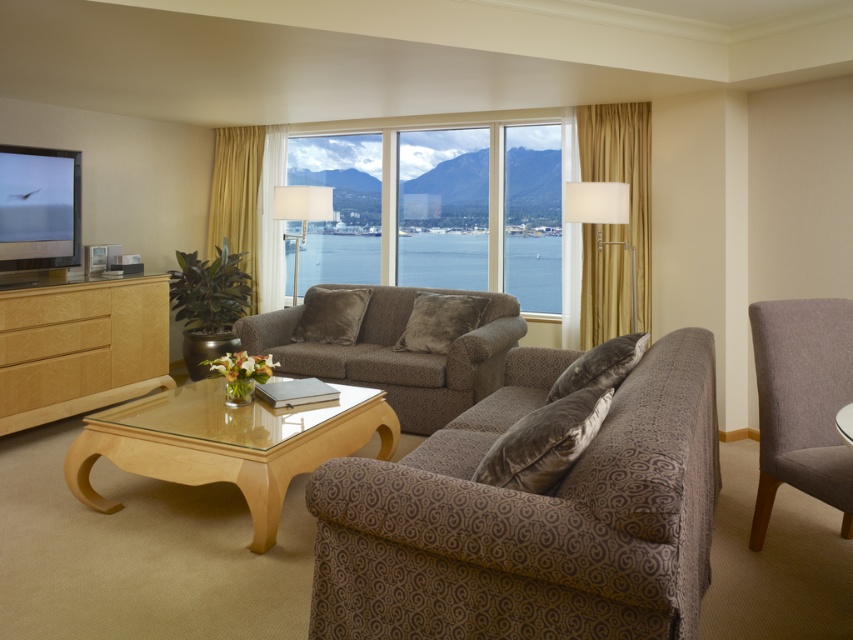
Question: Is gold textured curtain at right bigger than sheer yellow curtain at upper center?

Choices:
 (A) no
 (B) yes

Answer: (B)

Question: Among these objects, which one is nearest to the camera?

Choices:
 (A) patterned fabric couch at center
 (B) light brown wood drawer at lower left
 (C) wooden drawer at left

Answer: (A)

Question: Can you confirm if gold textured curtain at right is bigger than birch wood drawer at lower left?

Choices:
 (A) yes
 (B) no

Answer: (A)

Question: Is blue glass water at center behind light brown wood drawer at lower left?

Choices:
 (A) no
 (B) yes

Answer: (B)

Question: Among these points, which one is farthest from the camera?

Choices:
 (A) (102, 388)
 (B) (842, 426)

Answer: (A)

Question: Which point appears farthest from the camera in this image?

Choices:
 (A) (318, 250)
 (B) (289, 209)
 (C) (253, 349)
 (D) (390, 612)

Answer: (A)